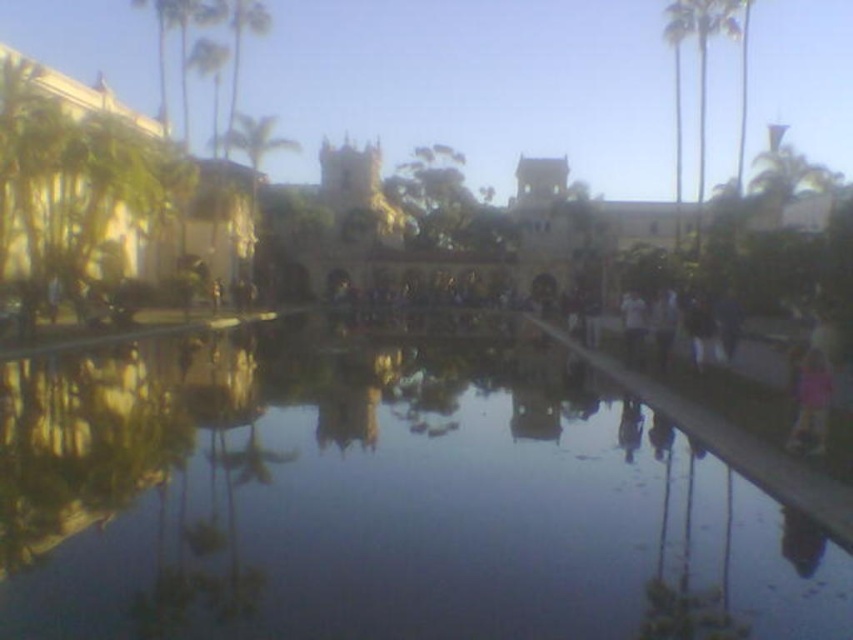
I want to click on transparent liquid water at center, so click(x=380, y=500).

Is point (758, 540) positioned behind point (708, 26)?

No, (758, 540) is in front of (708, 26).

Image resolution: width=853 pixels, height=640 pixels. Identify the location of transparent liquid water at center. (380, 500).

Is transparent liquid water at center closer to the viewer compared to green leafy palm tree at upper right?

Yes, transparent liquid water at center is closer to the viewer.

Does point (463, 554) lie in front of point (799, 172)?

Yes, it is in front of point (799, 172).

Where is `transparent liquid water at center`? This screenshot has height=640, width=853. transparent liquid water at center is located at coordinates (380, 500).

Who is higher up, green leafy palm tree at upper right or green leafy palm tree at right?

Positioned higher is green leafy palm tree at right.

Is green leafy palm tree at upper right bigger than green leafy palm tree at right?

Incorrect, green leafy palm tree at upper right is not larger than green leafy palm tree at right.

Where is `green leafy palm tree at upper right`? green leafy palm tree at upper right is located at coordinates (791, 186).